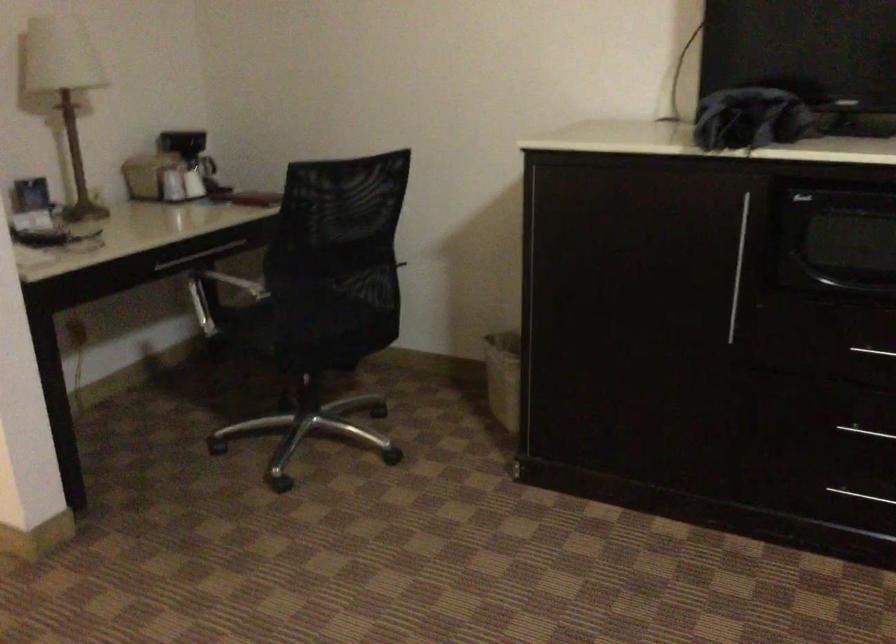
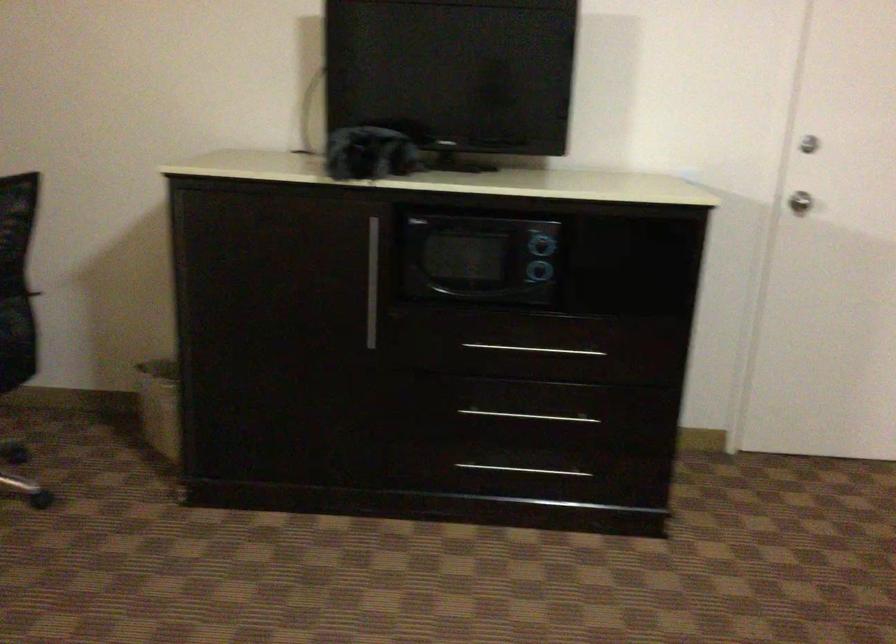
Find the pixel in the second image that matches the point at 733,263 in the first image.

(372, 283)